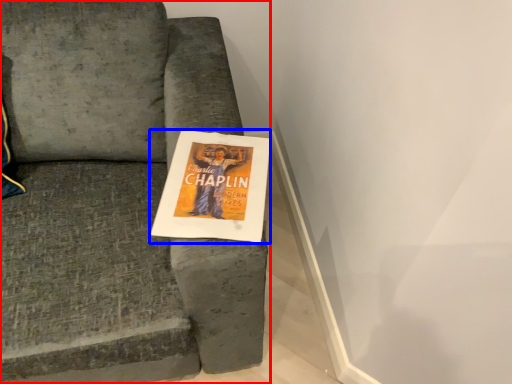
Question: Among these objects, which one is nearest to the camera, chair (highlighted by a red box) or flyer (highlighted by a blue box)?

Choices:
 (A) chair
 (B) flyer

Answer: (A)